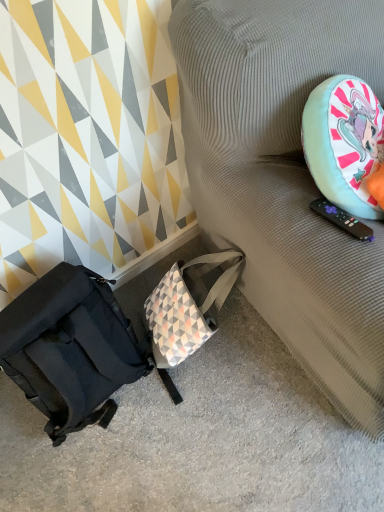
Where is `free space below matte black backpack at lower left (from a real-world perspective)`? The width and height of the screenshot is (384, 512). free space below matte black backpack at lower left (from a real-world perspective) is located at coordinates (116, 415).